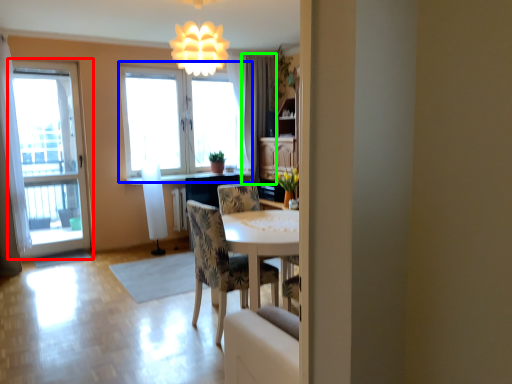
Question: Considering the real-world distances, which object is farthest from window (highlighted by a red box)? window (highlighted by a blue box) or curtain (highlighted by a green box)?

Choices:
 (A) window
 (B) curtain

Answer: (B)